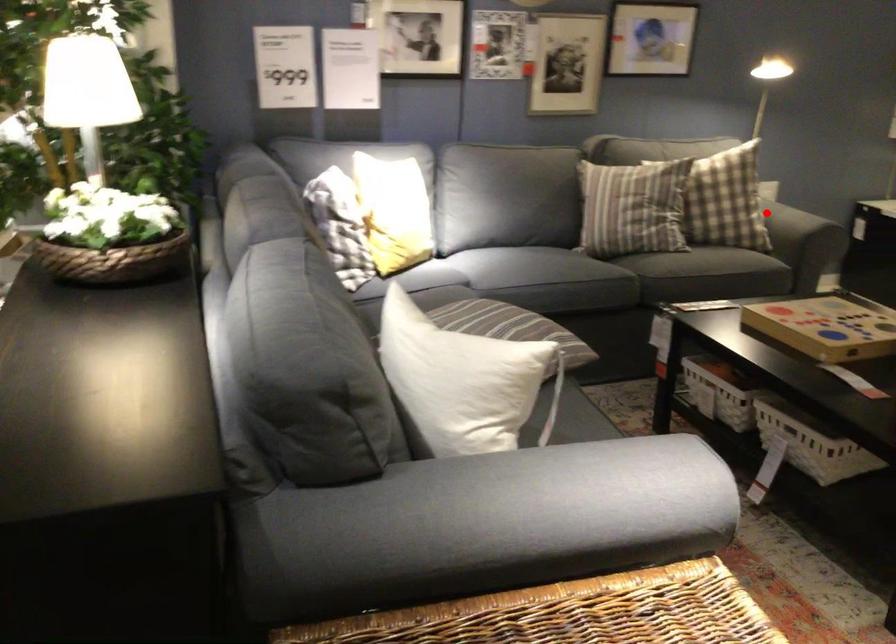
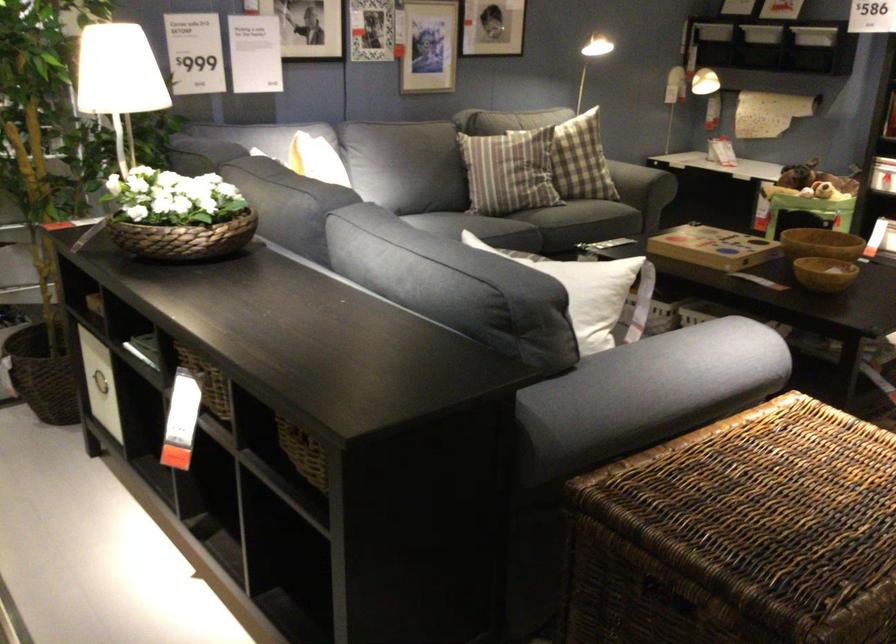
Question: I am providing you with two images of the same scene from different viewpoints. Given a red point in image1, look at the same physical point in image2. Is it:

Choices:
 (A) Closer to the viewpoint
 (B) Farther from the viewpoint

Answer: (B)